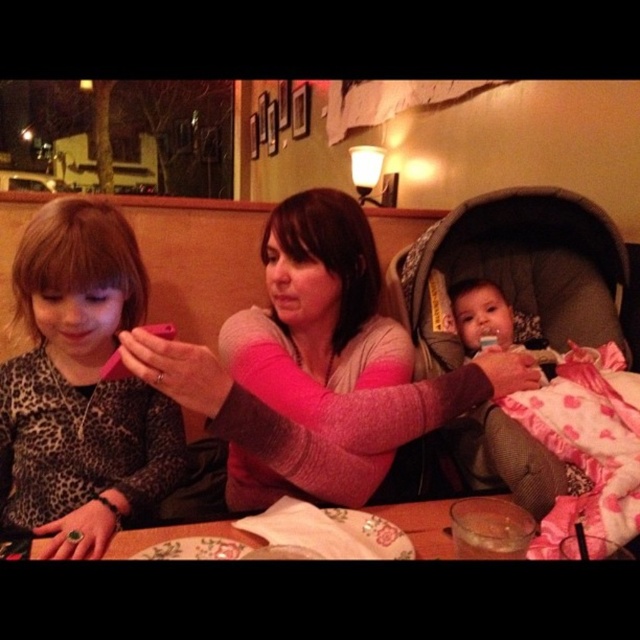
You are a delivery person who needs to place a small package between the dark gray fabric baby carriage at right and the leopard print sweater at left. Can you fit the package there?

The dark gray fabric baby carriage at right is wider than the leopard print sweater at left, so there should be enough space between them to fit a small package.

You are a delivery person who needs to place a small package between the dark gray fabric baby carriage at right and the leopard print sweater at left. The package is 30 centimeters long. Will there be enough space between them to place the package?

The distance between the dark gray fabric baby carriage at right and the leopard print sweater at left is 75.87 centimeters. Since the package is only 30 centimeters long, there is sufficient space to place it between them.

You are a delivery person standing outside the restaurant and need to hand a package to the person wearing the pink sweater at center. The package is 12 inches wide. Can you reach them without moving closer than 24 inches?

The pink sweater at center and viewer are 27.15 inches apart, so yes, you can reach them with the 12 inch wide package since the distance is greater than 24 inches.